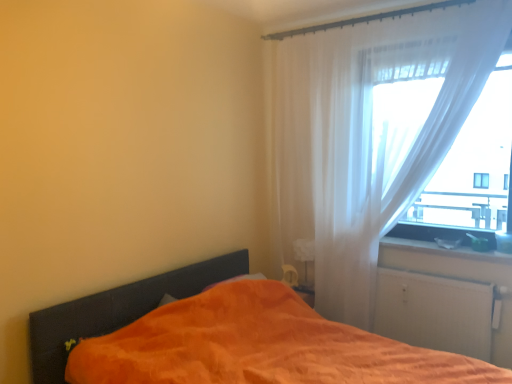
Question: Considering the relative sizes of white glossy window sill at lower right and white matte radiator at lower right in the image provided, is white glossy window sill at lower right shorter than white matte radiator at lower right?

Choices:
 (A) yes
 (B) no

Answer: (A)

Question: Is white glossy window sill at lower right with white matte radiator at lower right?

Choices:
 (A) no
 (B) yes

Answer: (A)

Question: Would you say white matte radiator at lower right is part of white glossy window sill at lower right's contents?

Choices:
 (A) no
 (B) yes

Answer: (A)

Question: Does white glossy window sill at lower right have a larger size compared to white matte radiator at lower right?

Choices:
 (A) no
 (B) yes

Answer: (A)

Question: From a real-world perspective, is white glossy window sill at lower right beneath white matte radiator at lower right?

Choices:
 (A) yes
 (B) no

Answer: (B)

Question: From the image's perspective, is white glossy window sill at lower right over white matte radiator at lower right?

Choices:
 (A) no
 (B) yes

Answer: (B)

Question: Does orange soft fabric bed at lower left lie behind white matte radiator at lower right?

Choices:
 (A) no
 (B) yes

Answer: (A)

Question: Is orange soft fabric bed at lower left facing towards white matte radiator at lower right?

Choices:
 (A) no
 (B) yes

Answer: (A)

Question: From the image's perspective, is orange soft fabric bed at lower left located beneath white matte radiator at lower right?

Choices:
 (A) yes
 (B) no

Answer: (A)

Question: Does orange soft fabric bed at lower left have a smaller size compared to white matte radiator at lower right?

Choices:
 (A) no
 (B) yes

Answer: (A)

Question: Is orange soft fabric bed at lower left directly adjacent to white matte radiator at lower right?

Choices:
 (A) yes
 (B) no

Answer: (B)

Question: Is orange soft fabric bed at lower left at the left side of white matte radiator at lower right?

Choices:
 (A) yes
 (B) no

Answer: (A)

Question: From a real-world perspective, is white glossy window sill at lower right physically below orange soft fabric bed at lower left?

Choices:
 (A) no
 (B) yes

Answer: (A)